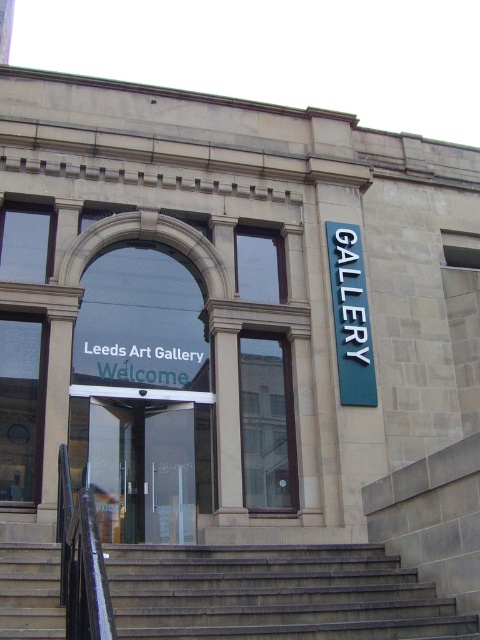
Question: Which of the following is the farthest from the observer?

Choices:
 (A) transparent glass door at center
 (B) blue metallic sign at upper right
 (C) gray concrete stairs at center

Answer: (B)

Question: Which point appears farthest from the camera in this image?

Choices:
 (A) (156, 408)
 (B) (359, 266)

Answer: (B)

Question: Is transparent glass door at center positioned before blue metallic sign at upper right?

Choices:
 (A) no
 (B) yes

Answer: (B)

Question: Among these objects, which one is farthest from the camera?

Choices:
 (A) blue metallic sign at upper right
 (B) gray concrete stairs at center

Answer: (A)

Question: Can you confirm if gray concrete stairs at center is bigger than transparent glass door at center?

Choices:
 (A) no
 (B) yes

Answer: (B)

Question: Is gray concrete stairs at center smaller than transparent glass door at center?

Choices:
 (A) yes
 (B) no

Answer: (B)